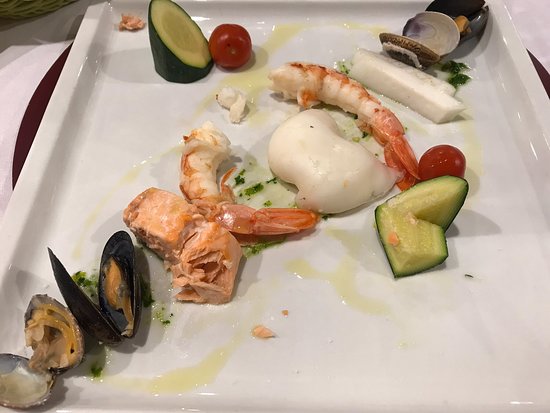
Identify the location of dark purple placemat. (27, 125).